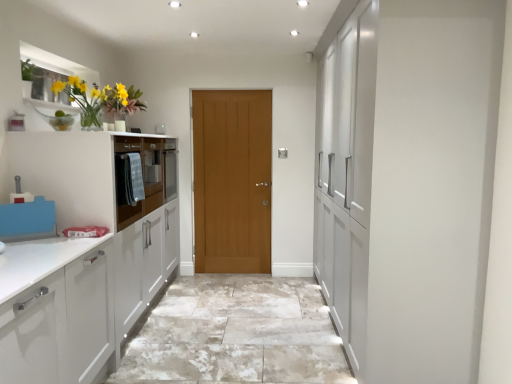
Question: From a real-world perspective, is light brown wooden door at center located higher than matte gray oven at left?

Choices:
 (A) no
 (B) yes

Answer: (A)

Question: Considering the relative sizes of light brown wooden door at center and matte gray oven at left in the image provided, is light brown wooden door at center shorter than matte gray oven at left?

Choices:
 (A) no
 (B) yes

Answer: (A)

Question: From a real-world perspective, is light brown wooden door at center under matte gray oven at left?

Choices:
 (A) yes
 (B) no

Answer: (A)

Question: From the image's perspective, is light brown wooden door at center on matte gray oven at left?

Choices:
 (A) yes
 (B) no

Answer: (B)

Question: Does light brown wooden door at center contain matte gray oven at left?

Choices:
 (A) no
 (B) yes

Answer: (A)

Question: Is light brown wooden door at center positioned with its back to matte gray oven at left?

Choices:
 (A) yes
 (B) no

Answer: (B)

Question: Can you confirm if matte glass vase at upper left is smaller than natural stone floor at center?

Choices:
 (A) no
 (B) yes

Answer: (B)

Question: Does matte glass vase at upper left have a greater height compared to natural stone floor at center?

Choices:
 (A) yes
 (B) no

Answer: (A)

Question: From the image's perspective, is matte glass vase at upper left located beneath natural stone floor at center?

Choices:
 (A) no
 (B) yes

Answer: (A)

Question: Does matte glass vase at upper left contain natural stone floor at center?

Choices:
 (A) no
 (B) yes

Answer: (A)

Question: Is natural stone floor at center at the back of matte glass vase at upper left?

Choices:
 (A) no
 (B) yes

Answer: (A)

Question: Considering the relative sizes of matte glass vase at upper left and natural stone floor at center in the image provided, is matte glass vase at upper left bigger than natural stone floor at center?

Choices:
 (A) no
 (B) yes

Answer: (A)

Question: Is matte gray oven at left surrounded by matte glass vase at upper left?

Choices:
 (A) no
 (B) yes

Answer: (A)